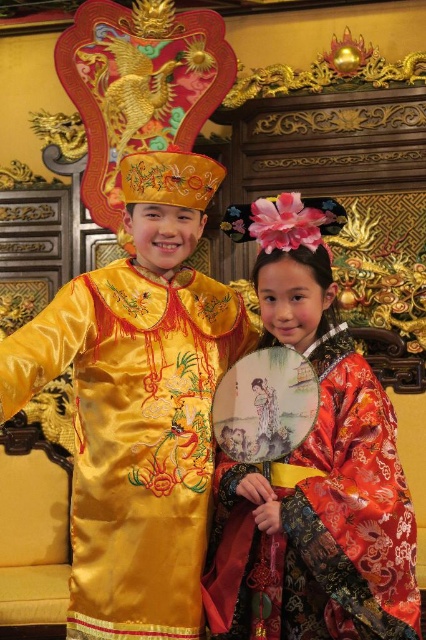
You are organizing a fashion show and need to decide which outfit requires a wider runway to accommodate its movement. Based on the image, which outfit between the satin yellow robe at center and the silky red dress at center would need more space due to its width?

The satin yellow robe at center might be wider than silky red dress at center, so it would require a wider runway to accommodate its movement.

You are a photographer setting up for a traditional Chinese photo shoot. You need to position a camera on a tripod so that both the satin yellow robe at center and the silky red dress at center are in focus. Given that the camera can only focus on objects within a 1.2 meter height range, will both subjects be in focus?

The satin yellow robe at center is much taller than the silky red dress at center. If the height difference between them is more than 1.2 meters, then they won cannot both be in focus. However, since the exact heights aren not provided, we cannot definitively answer this.